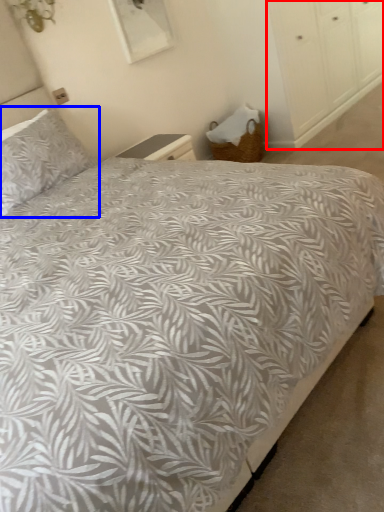
Question: Among these objects, which one is nearest to the camera, dresser (highlighted by a red box) or pillow (highlighted by a blue box)?

Choices:
 (A) dresser
 (B) pillow

Answer: (B)